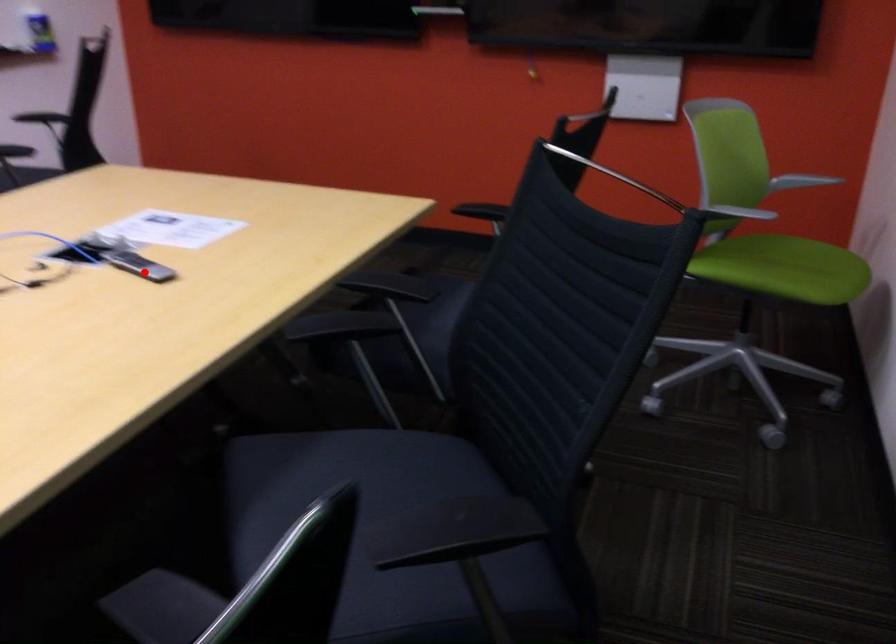
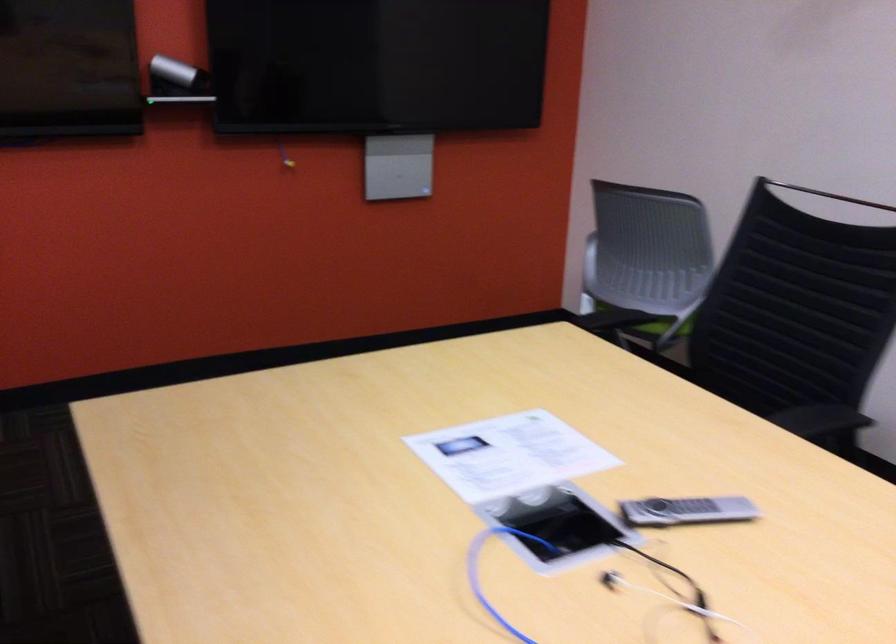
Question: I am providing you with two images of the same scene from different viewpoints. A red point is marked on the first image. At the location where the point appears in image 1, is it still visible in image 2?

Choices:
 (A) Yes
 (B) No

Answer: (A)